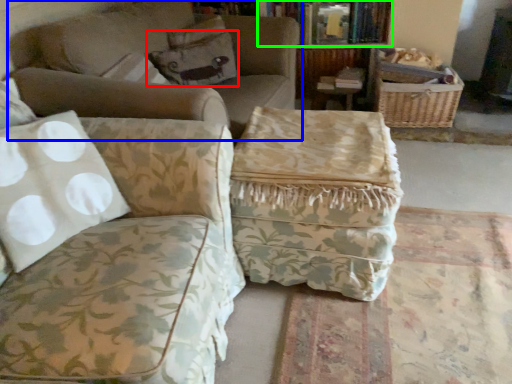
Question: Based on their relative distances, which object is nearer to pillow (highlighted by a red box)? Choose from studio couch (highlighted by a blue box) and book (highlighted by a green box).

Choices:
 (A) studio couch
 (B) book

Answer: (A)